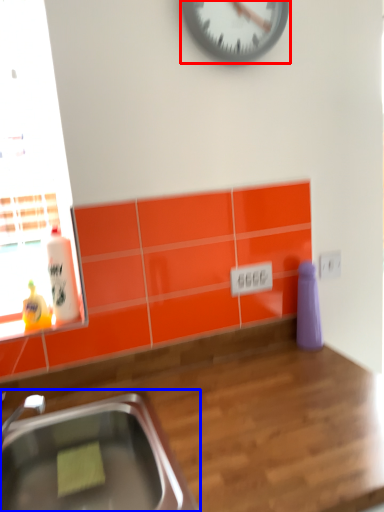
Question: Which of the following is the closest to the observer, wall clock (highlighted by a red box) or sink (highlighted by a blue box)?

Choices:
 (A) wall clock
 (B) sink

Answer: (B)